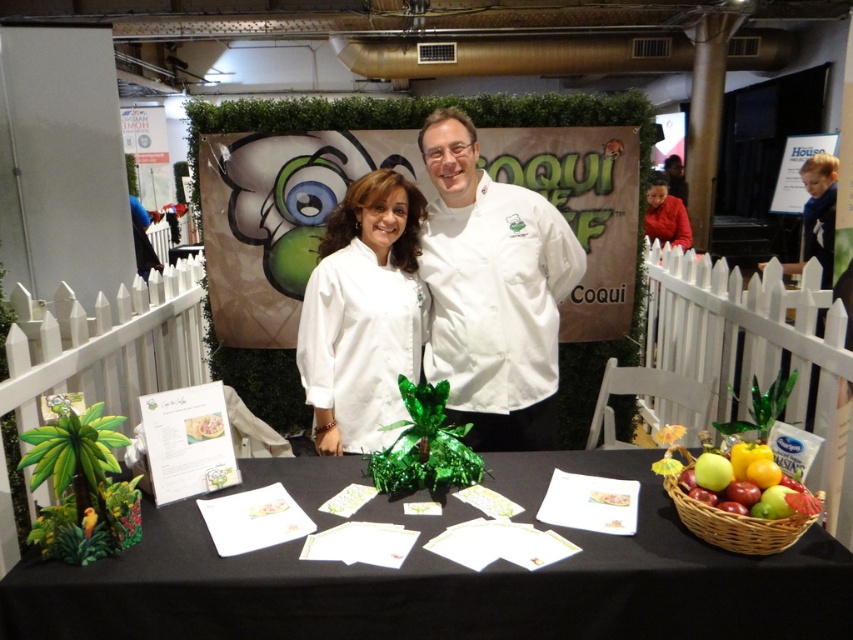
In the scene shown: Who is lower down, white matte chef coat at center or woven brown basket at lower right?

Positioned lower is woven brown basket at lower right.

Which of these two, white matte chef coat at center or woven brown basket at lower right, stands taller?

Standing taller between the two is white matte chef coat at center.

Between point (361, 184) and point (688, 454), which one is positioned in front?

Point (688, 454)

You are a GUI agent. You are given a task and a screenshot of the screen. Output one action in this format:
    pyautogui.click(x=<x>, y=<y>)
    Task: Click on the white matte chef coat at center
    This screenshot has width=853, height=640.
    Given the screenshot: What is the action you would take?
    pyautogui.click(x=363, y=314)

Which is below, white matte chef coat at center or green matte apple at center?

green matte apple at center

Does white matte chef coat at center appear on the right side of green matte apple at center?

In fact, white matte chef coat at center is to the left of green matte apple at center.

Does point (325, 451) come in front of point (728, 481)?

No, (325, 451) is behind (728, 481).

Locate an element on the screen. The height and width of the screenshot is (640, 853). white matte chef coat at center is located at coordinates (363, 314).

Does black fabric table at center have a greater width compared to white glossy chef coat at center?

Yes, black fabric table at center is wider than white glossy chef coat at center.

Does black fabric table at center have a lesser height compared to white glossy chef coat at center?

Yes.

Is point (782, 609) in front of point (523, 204)?

Yes.

Image resolution: width=853 pixels, height=640 pixels. In order to click on black fabric table at center in this screenshot , I will do `click(444, 579)`.